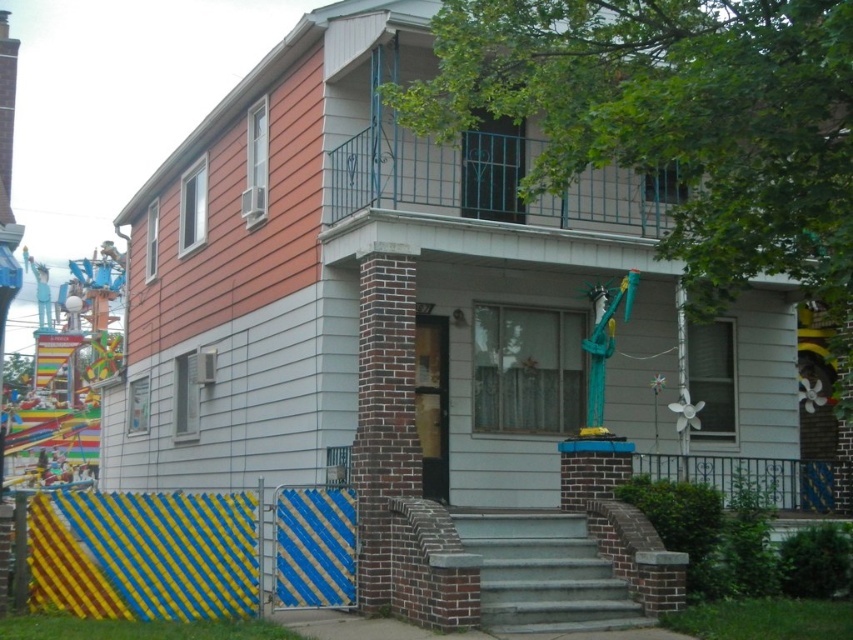
Question: Which of the following is the farthest from the observer?

Choices:
 (A) (556, 595)
 (B) (167, 609)

Answer: (A)

Question: Does yellow and blue striped gate at lower left appear under gray concrete stairs at center?

Choices:
 (A) no
 (B) yes

Answer: (A)

Question: In this image, where is yellow and blue striped gate at lower left located relative to gray concrete stairs at center?

Choices:
 (A) right
 (B) left

Answer: (B)

Question: In this image, where is yellow and blue striped gate at lower left located relative to gray concrete stairs at center?

Choices:
 (A) right
 (B) left

Answer: (B)

Question: Which object is farther from the camera taking this photo?

Choices:
 (A) gray concrete stairs at center
 (B) yellow and blue striped gate at lower left

Answer: (A)